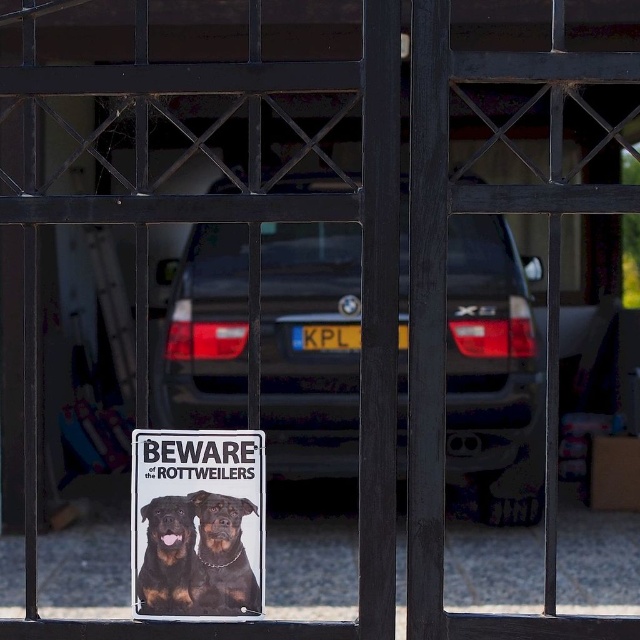
In the scene shown: You are standing in front of the metal gate and want to know which of the two points, point [500,221] or point [250,592], is closer to you. Can you determine this based on their positions?

Point [500,221] is further to the camera than point [250,592], so the closer point to you is point [250,592].

You are a delivery person trying to enter the property through the gate. The gate is slightly open, and you see a matte black car at center and a rottweiler at center. Can you safely walk between them to pass through?

The distance between the matte black car at center and the rottweiler at center is 4.17 meters, so yes, you can safely walk between them to pass through.

You are standing in front of the metal gate with a grid pattern. There is a sign attached to the gate. Where is the point located at coordinate (196, 522) on the sign?

The point at coordinate (196, 522) is on the metallic silver sign at center.